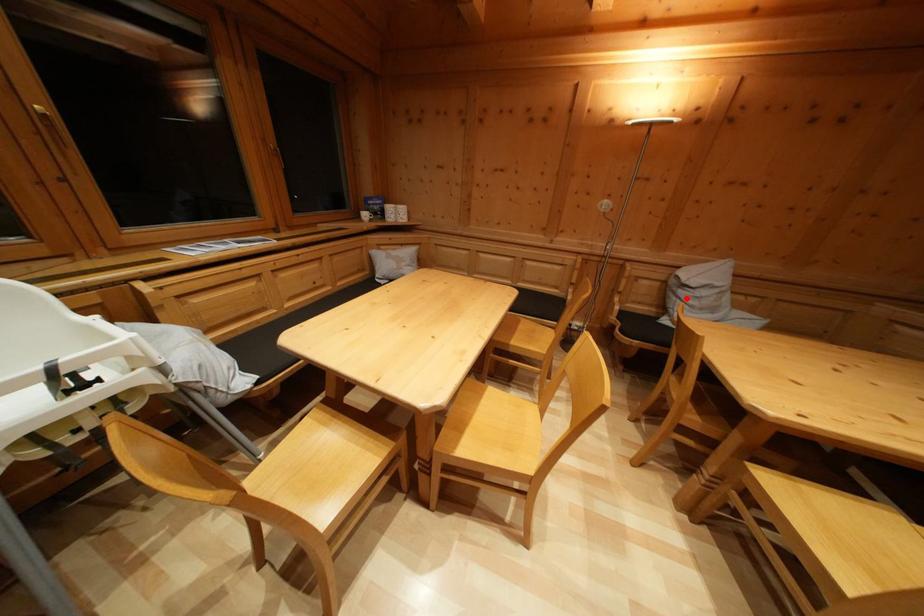
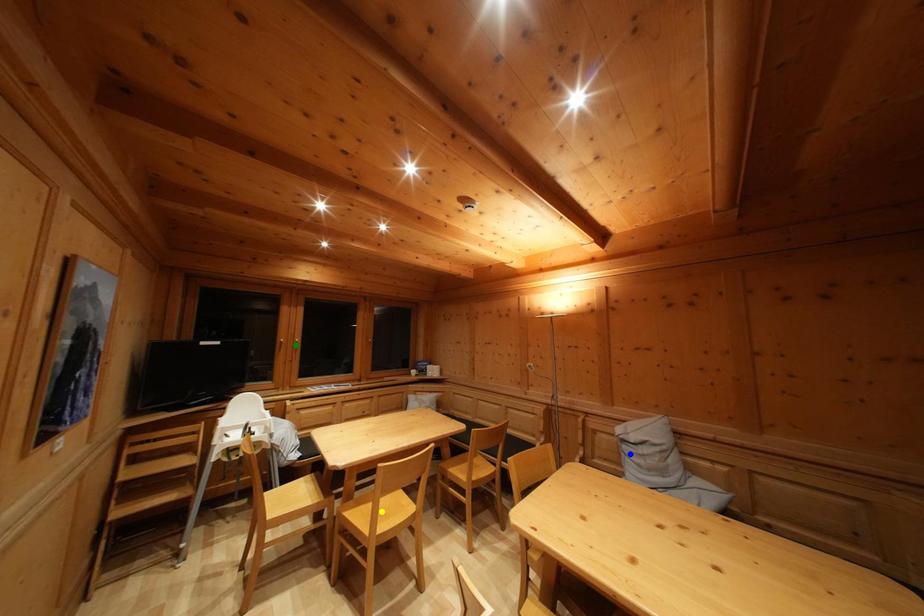
Question: I am providing you with two images of the same scene from different viewpoints. A red point is marked on the first image. You are given multiple points on the second image. Which point in image 2 represents the same 3d spot as the red point in image 1?

Choices:
 (A) yellow point
 (B) green point
 (C) blue point

Answer: (C)